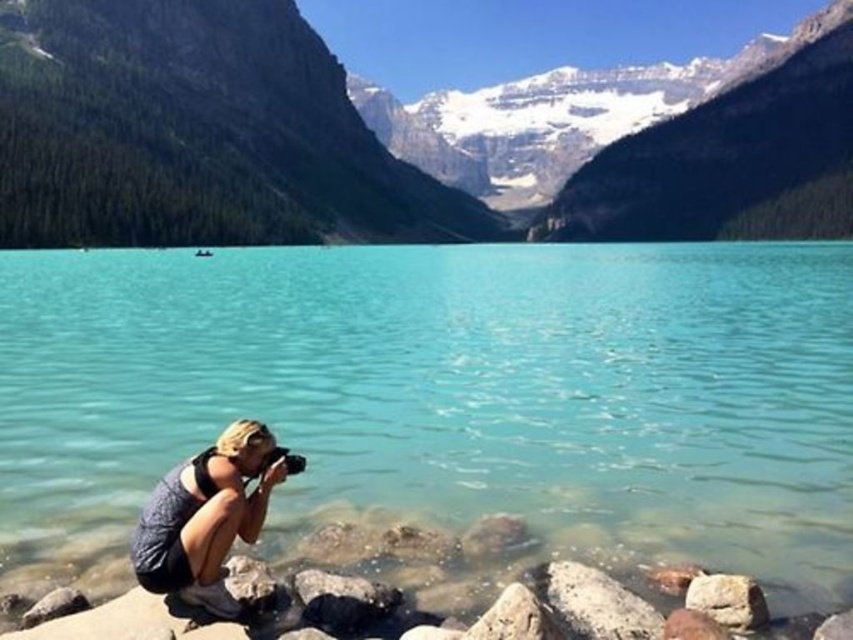
Question: Considering the relative positions of green forested mountain at upper center and smooth gray rock at lower center in the image provided, where is green forested mountain at upper center located with respect to smooth gray rock at lower center?

Choices:
 (A) above
 (B) below

Answer: (A)

Question: Among these objects, which one is farthest from the camera?

Choices:
 (A) gray fabric camera at lower left
 (B) clear glass water at center
 (C) smooth gray rock at lower right
 (D) smooth gray rock at lower center

Answer: (B)

Question: Estimate the real-world distances between objects in this image. Which object is farther from the green forested mountain at upper center?

Choices:
 (A) gray fabric camera at lower left
 (B) smooth gray rock at lower center
 (C) clear glass water at center
 (D) smooth gray rock at lower right

Answer: (D)

Question: Which point is farther to the camera?

Choices:
 (A) smooth gray rock at lower right
 (B) gray fabric camera at lower left
 (C) green forested mountain at upper center
 (D) smooth gray rock at lower center

Answer: (C)

Question: Is green forested mountain at upper center smaller than smooth gray rock at lower center?

Choices:
 (A) yes
 (B) no

Answer: (B)

Question: Does green forested mountain at upper center appear over smooth gray rock at lower right?

Choices:
 (A) no
 (B) yes

Answer: (B)